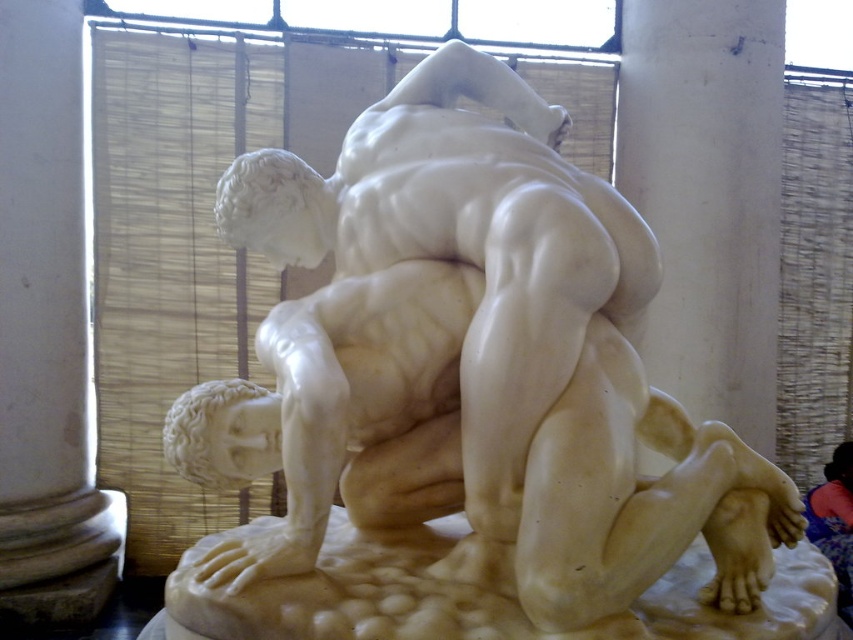
Question: Which object is closer to the camera taking this photo?

Choices:
 (A) white marble statue at center
 (B) white marble at center

Answer: (A)

Question: Is white marble statue at center positioned before white marble at center?

Choices:
 (A) yes
 (B) no

Answer: (A)

Question: Is white marble pillar at left behind white marble at center?

Choices:
 (A) no
 (B) yes

Answer: (B)

Question: Which point is farther from the camera taking this photo?

Choices:
 (A) (345, 420)
 (B) (42, 323)
 (C) (405, 544)

Answer: (B)

Question: Observing the image, what is the correct spatial positioning of white marble statue at center in reference to white marble pillar at left?

Choices:
 (A) left
 (B) right

Answer: (B)

Question: Which point is closer to the camera taking this photo?

Choices:
 (A) (373, 625)
 (B) (84, 595)

Answer: (A)